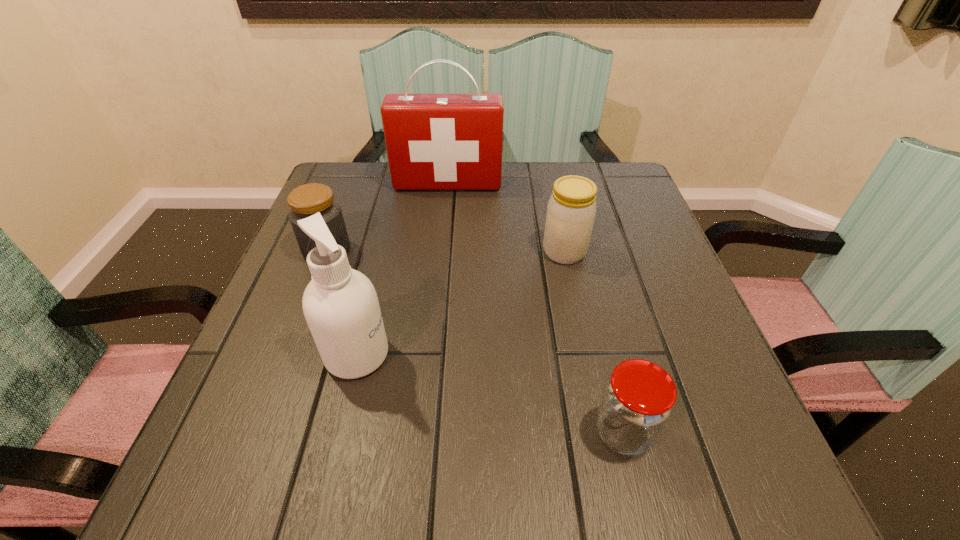
In order to click on free space at the near right corner of the desktop in this screenshot , I will do `click(708, 505)`.

What are the coordinates of `free area in between the second nearest object and the first-aid kit` in the screenshot? It's located at (402, 269).

At what (x,y) coordinates should I click in order to perform the action: click on empty space that is in between the nearest jar and the second nearest object. Please return your answer as a coordinate pair (x, y). The height and width of the screenshot is (540, 960). Looking at the image, I should click on (490, 393).

Identify the location of free space that is in between the leftmost jar and the nearest object. (475, 341).

Where is `vacant space in between the farthest object and the leftmost jar`? vacant space in between the farthest object and the leftmost jar is located at coordinates (387, 217).

Identify the location of vacant area between the cleansing agent and the nearest jar. click(490, 393).

Select which object appears as the third closest to the nearest object. Please provide its 2D coordinates. Your answer should be formatted as a tuple, i.e. [(x, y)], where the tuple contains the x and y coordinates of a point satisfying the conditions above.

[(306, 200)]

Identify which object is located as the fourth nearest to the second nearest object. Please provide its 2D coordinates. Your answer should be formatted as a tuple, i.e. [(x, y)], where the tuple contains the x and y coordinates of a point satisfying the conditions above.

[(434, 141)]

The width and height of the screenshot is (960, 540). Find the location of `jar that stands as the second closest to the first-aid kit`. jar that stands as the second closest to the first-aid kit is located at coordinates (571, 210).

Locate which jar is the closest to the first-aid kit. Please provide its 2D coordinates. Your answer should be formatted as a tuple, i.e. [(x, y)], where the tuple contains the x and y coordinates of a point satisfying the conditions above.

[(306, 200)]